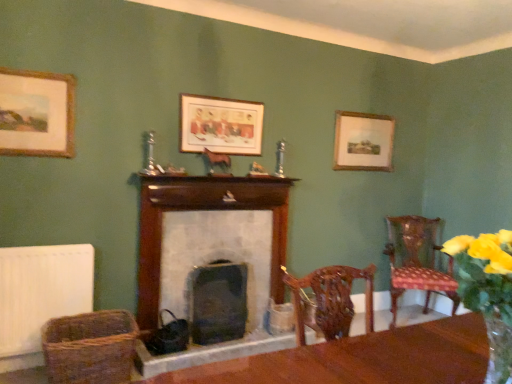
Measure the distance between black stone fireplace at center, which is the 1th fireplace in bottom-to-top order, and camera.

black stone fireplace at center, which is the 1th fireplace in bottom-to-top order, is 3.23 meters from camera.

You are a GUI agent. You are given a task and a screenshot of the screen. Output one action in this format:
    pyautogui.click(x=<x>, y=<y>)
    Task: Click on the polka dot fabric chair at right
    Image resolution: width=512 pixels, height=384 pixels.
    Given the screenshot: What is the action you would take?
    pyautogui.click(x=418, y=260)

Describe the element at coordinates (220, 125) in the screenshot. The width and height of the screenshot is (512, 384). I see `matte wooden picture frame at center, which is the second picture frame from back to front` at that location.

The height and width of the screenshot is (384, 512). What do you see at coordinates (488, 292) in the screenshot?
I see `yellow fabric flower at right` at bounding box center [488, 292].

In order to face yellow fabric flower at right, should I rotate leftwards or rightwards?

Turn right approximately 29.735 degrees to face it.

The width and height of the screenshot is (512, 384). I want to click on black stone fireplace at center, which is the 1th fireplace in bottom-to-top order, so click(217, 302).

The width and height of the screenshot is (512, 384). What are the coordinates of `radiator located below the wooden picture frame at upper right, placed as the 1th picture frame when sorted from back to front (from the image's perspective)` in the screenshot? It's located at (41, 291).

Is white matte radiator at lower left far from wooden picture frame at upper right, placed as the 1th picture frame when sorted from back to front?

Yes, white matte radiator at lower left is far from wooden picture frame at upper right, placed as the 1th picture frame when sorted from back to front.

Considering their positions, is white matte radiator at lower left located in front of or behind wooden picture frame at upper right, the third picture frame positioned from the front?

Clearly, white matte radiator at lower left is in front of wooden picture frame at upper right, the third picture frame positioned from the front.

Between wooden picture frame at upper right, the 1th picture frame when ordered from right to left, and black stone fireplace at center, which is the 1th fireplace in bottom-to-top order, which one has less height?

wooden picture frame at upper right, the 1th picture frame when ordered from right to left, is shorter.

Is wooden picture frame at upper right, the third picture frame positioned from the front, further to camera compared to black stone fireplace at center, which is the 1th fireplace in bottom-to-top order?

Yes, it is.

Is wooden picture frame at upper right, placed as the 1th picture frame when sorted from back to front, aimed at black stone fireplace at center, which is the 1th fireplace in bottom-to-top order?

No, wooden picture frame at upper right, placed as the 1th picture frame when sorted from back to front, is not facing towards black stone fireplace at center, which is the 1th fireplace in bottom-to-top order.

Which is more to the right, wooden picture frame at upper right, the third picture frame positioned from the front, or black stone fireplace at center, placed as the 2th fireplace when sorted from top to bottom?

From the viewer's perspective, wooden picture frame at upper right, the third picture frame positioned from the front, appears more on the right side.

Would you say white matte radiator at lower left is a long distance from black stone fireplace at center, placed as the 2th fireplace when sorted from top to bottom?

white matte radiator at lower left is positioned a significant distance from black stone fireplace at center, placed as the 2th fireplace when sorted from top to bottom.

Is white matte radiator at lower left inside the boundaries of black stone fireplace at center, placed as the 2th fireplace when sorted from top to bottom, or outside?

white matte radiator at lower left is not inside black stone fireplace at center, placed as the 2th fireplace when sorted from top to bottom, it's outside.

From the white matte radiator at lower left, count 1st fireplace to the right and point to it. Please provide its 2D coordinates.

[(217, 302)]

From the image's perspective, is white matte radiator at lower left above or below black stone fireplace at center, which is the 1th fireplace in bottom-to-top order?

white matte radiator at lower left is situated higher than black stone fireplace at center, which is the 1th fireplace in bottom-to-top order, in the image.

Can you confirm if matte wooden picture frame at center, the second picture frame viewed from the right, is shorter than wooden picture frame at upper left, which is the third picture frame in right-to-left order?

Correct, matte wooden picture frame at center, the second picture frame viewed from the right, is not as tall as wooden picture frame at upper left, which is the third picture frame in right-to-left order.

Does matte wooden picture frame at center, the second picture frame viewed from the right, appear on the left side of wooden picture frame at upper left, which is the third picture frame in right-to-left order?

In fact, matte wooden picture frame at center, the second picture frame viewed from the right, is to the right of wooden picture frame at upper left, which is the third picture frame in right-to-left order.

Does point (246, 155) come closer to viewer compared to point (29, 134)?

No, it is not.

Is matte wooden picture frame at center, the 2th picture frame from the left, not near wooden picture frame at upper left, positioned as the third picture frame in back-to-front order?

Indeed, matte wooden picture frame at center, the 2th picture frame from the left, is not near wooden picture frame at upper left, positioned as the third picture frame in back-to-front order.

Considering the sizes of objects woven brown basket at lower left and polka dot fabric chair at right in the image provided, who is shorter, woven brown basket at lower left or polka dot fabric chair at right?

With less height is woven brown basket at lower left.

From the image's perspective, is woven brown basket at lower left on top of polka dot fabric chair at right?

No.

Is point (119, 361) more distant than point (433, 253)?

No, (119, 361) is in front of (433, 253).

Is woven brown basket at lower left positioned behind polka dot fabric chair at right?

No, the depth of woven brown basket at lower left is less than that of polka dot fabric chair at right.

Can you confirm if white matte radiator at lower left is wider than woven brown basket at lower left?

No, white matte radiator at lower left is not wider than woven brown basket at lower left.

Could you tell me if white matte radiator at lower left is turned towards woven brown basket at lower left?

Yes, white matte radiator at lower left is aimed at woven brown basket at lower left.

How different are the orientations of white matte radiator at lower left and woven brown basket at lower left in degrees?

3.6 degrees.

Considering their positions, is white matte radiator at lower left located in front of or behind woven brown basket at lower left?

Clearly, white matte radiator at lower left is behind woven brown basket at lower left.

Is point (27, 251) closer to camera compared to point (490, 242)?

That is False.

Considering the relative sizes of white matte radiator at lower left and yellow fabric flower at right in the image provided, is white matte radiator at lower left thinner than yellow fabric flower at right?

Yes, white matte radiator at lower left is thinner than yellow fabric flower at right.

This screenshot has height=384, width=512. In order to click on radiator that appears below the yellow fabric flower at right (from the image's perspective) in this screenshot , I will do tap(41, 291).

I want to click on the 2nd picture frame behind the white matte radiator at lower left, starting your count from the anchor, so click(x=362, y=141).

The height and width of the screenshot is (384, 512). What are the coordinates of `the 1st fireplace in front of the wooden picture frame at upper right, the third picture frame viewed from the left` in the screenshot? It's located at (217, 302).

Based on the photo, when comparing their distances from black stone fireplace at center, which is the 1th fireplace in bottom-to-top order, does smooth wood fireplace at center, the 2th fireplace when ordered from bottom to top, or yellow fabric flower at right seem further?

yellow fabric flower at right lies further to black stone fireplace at center, which is the 1th fireplace in bottom-to-top order, than the other object.

From the image, which object appears to be farther from matte wooden picture frame at center, the 2th picture frame from the left, polka dot fabric chair at right or wooden picture frame at upper left, the 1th picture frame from the left?

Among the two, polka dot fabric chair at right is located further to matte wooden picture frame at center, the 2th picture frame from the left.

Estimate the real-world distances between objects in this image. Which object is further from matte wooden picture frame at center, which is the second picture frame from back to front, smooth wood fireplace at center, acting as the 1th fireplace starting from the top, or wooden picture frame at upper left, the 1th picture frame from the left?

Based on the image, wooden picture frame at upper left, the 1th picture frame from the left, appears to be further to matte wooden picture frame at center, which is the second picture frame from back to front.

Which object lies nearer to the anchor point matte wooden picture frame at center, the 2th picture frame from the left, polka dot fabric chair at right or woven brown basket at lower left?

woven brown basket at lower left.

Looking at the image, which one is located closer to polka dot fabric chair at right, black stone fireplace at center, which is the 1th fireplace in bottom-to-top order, or matte wooden picture frame at center, acting as the 2th picture frame starting from the front?

Among the two, black stone fireplace at center, which is the 1th fireplace in bottom-to-top order, is located nearer to polka dot fabric chair at right.

From the image, which object appears to be nearer to white matte radiator at lower left, smooth wood fireplace at center, the 2th fireplace when ordered from bottom to top, or matte wooden picture frame at center, the 2th picture frame from the left?

smooth wood fireplace at center, the 2th fireplace when ordered from bottom to top, is positioned closer to the anchor white matte radiator at lower left.

Considering their positions, is woven brown basket at lower left positioned further to polka dot fabric chair at right than wooden picture frame at upper left, the 1th picture frame from the left?

wooden picture frame at upper left, the 1th picture frame from the left, is positioned further to the anchor polka dot fabric chair at right.

Considering their positions, is wooden picture frame at upper right, the 1th picture frame when ordered from right to left, positioned closer to woven brown basket at lower left than wooden picture frame at upper left, which is the third picture frame in right-to-left order?

wooden picture frame at upper left, which is the third picture frame in right-to-left order, is positioned closer to the anchor woven brown basket at lower left.

The image size is (512, 384). Find the location of `radiator between wooden picture frame at upper left, which is the third picture frame in right-to-left order, and polka dot fabric chair at right, in the horizontal direction`. radiator between wooden picture frame at upper left, which is the third picture frame in right-to-left order, and polka dot fabric chair at right, in the horizontal direction is located at coordinates (41, 291).

The height and width of the screenshot is (384, 512). Identify the location of fireplace situated between white matte radiator at lower left and smooth wood fireplace at center, the 2th fireplace when ordered from bottom to top, from left to right. (217, 302).

You are a GUI agent. You are given a task and a screenshot of the screen. Output one action in this format:
    pyautogui.click(x=<x>, y=<y>)
    Task: Click on the floral arrangement located between wooden picture frame at upper left, which is the third picture frame in right-to-left order, and polka dot fabric chair at right in the left-right direction
    The width and height of the screenshot is (512, 384).
    Given the screenshot: What is the action you would take?
    pyautogui.click(x=488, y=292)

Where is `basket situated between white matte radiator at lower left and polka dot fabric chair at right from left to right`? The image size is (512, 384). basket situated between white matte radiator at lower left and polka dot fabric chair at right from left to right is located at coordinates (90, 347).